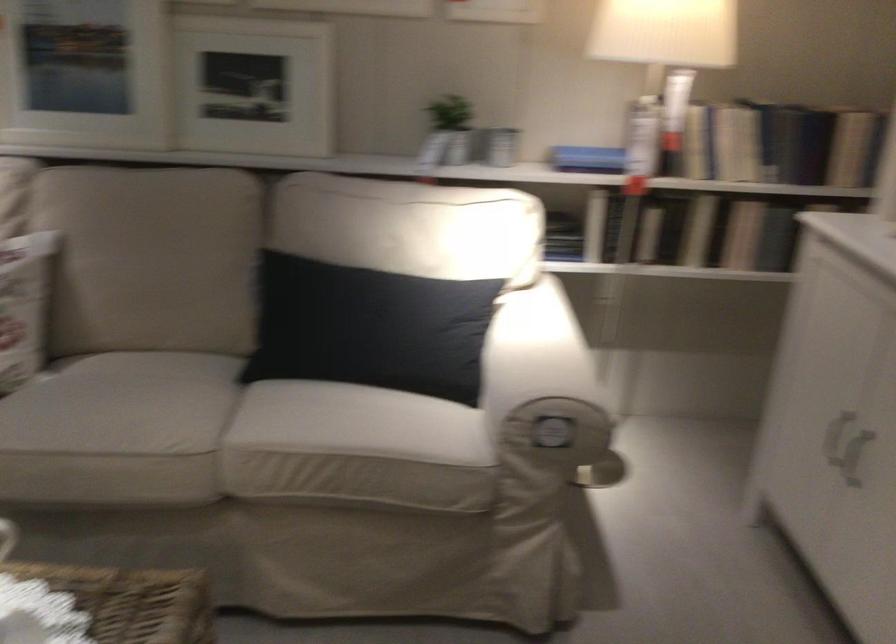
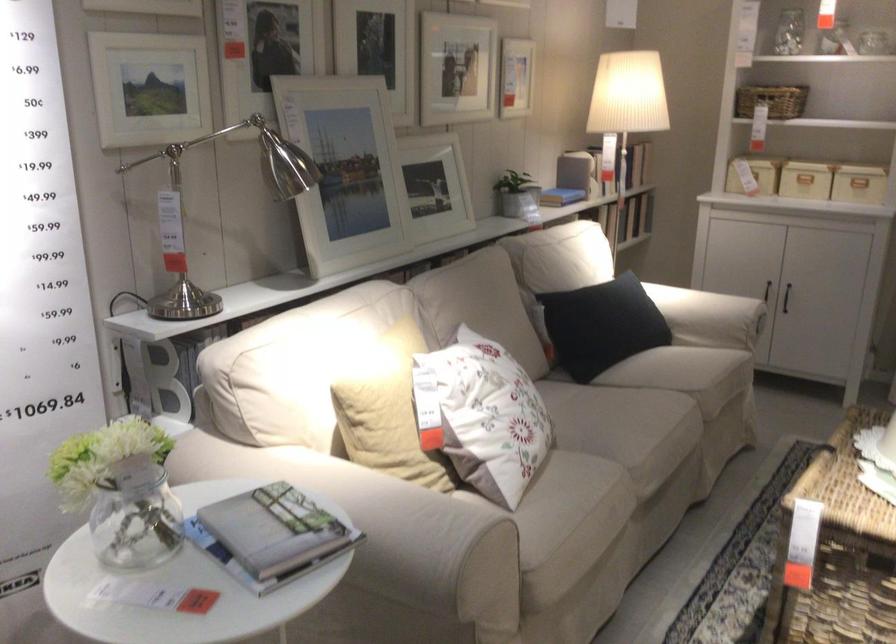
Find the pixel in the second image that matches point (466, 389) in the first image.

(709, 317)